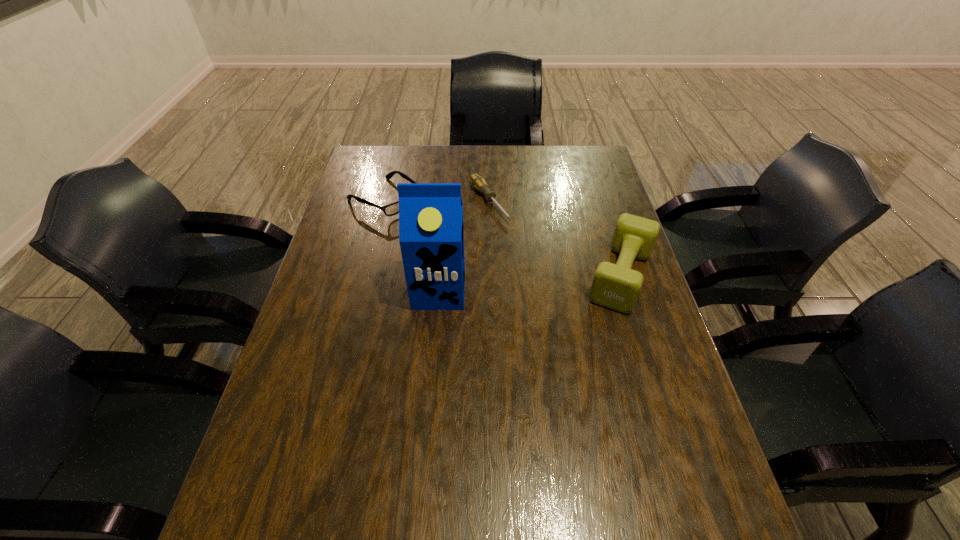
In the image, there is a desktop. Identify the location of vacant space at the far edge. Image resolution: width=960 pixels, height=540 pixels. (492, 176).

The height and width of the screenshot is (540, 960). In the image, there is a desktop. Identify the location of vacant space at the left edge. (363, 326).

Locate an element on the screen. This screenshot has width=960, height=540. blank area at the right edge is located at coordinates (617, 413).

This screenshot has width=960, height=540. In order to click on vacant space at the far right corner of the desktop in this screenshot , I will do `click(606, 179)`.

The width and height of the screenshot is (960, 540). What are the coordinates of `unoccupied area between the third object from right to left and the second object from right to left` in the screenshot? It's located at (464, 247).

This screenshot has width=960, height=540. Find the location of `empty space that is in between the tallest object and the third object from left to right`. empty space that is in between the tallest object and the third object from left to right is located at coordinates (464, 247).

Where is `vacant area that lies between the dumbbell and the third tallest object`? vacant area that lies between the dumbbell and the third tallest object is located at coordinates (503, 238).

The height and width of the screenshot is (540, 960). I want to click on unoccupied area between the rightmost object and the third tallest object, so click(x=503, y=238).

Locate an element on the screen. free space between the rightmost object and the screwdriver is located at coordinates (555, 239).

At what (x,y) coordinates should I click in order to perform the action: click on free space between the carton and the shortest object. Please return your answer as a coordinate pair (x, y). Looking at the image, I should click on (464, 247).